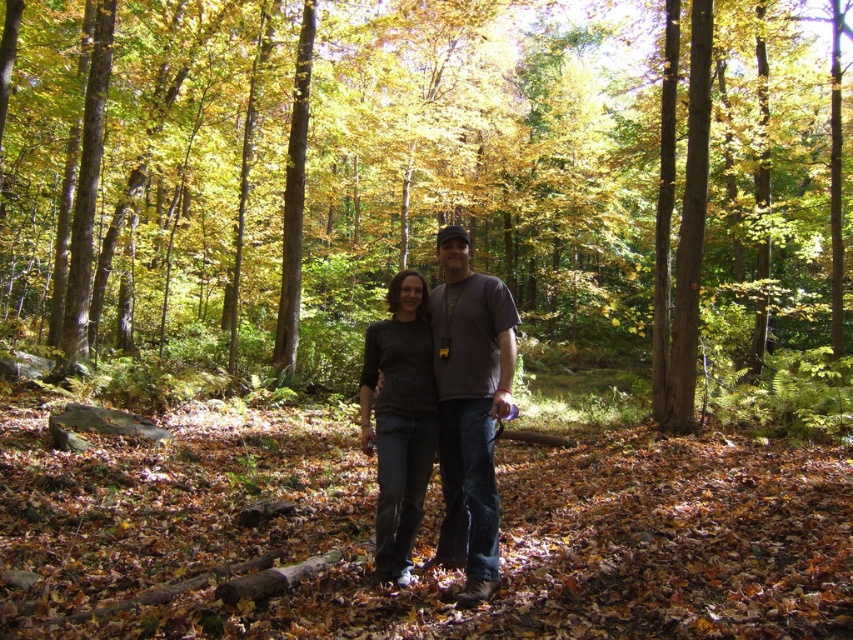
You are planning to take a photo of two people in the autumn forest. You notice the dark gray sweater at center and the knit sweater at center. Which sweater should you focus on to ensure the person wearing it is clearly visible in the photo?

The dark gray sweater at center is in front of the knit sweater at center, so focusing on the dark gray sweater at center will ensure the person wearing it is clearly visible in the photo.